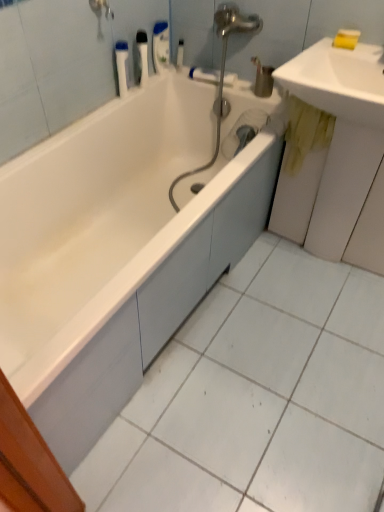
Question: Could you tell me if white plastic bottle at upper center, which is counted as the 3th toiletry, starting from the left, is turned towards yellow stained wood at right?

Choices:
 (A) no
 (B) yes

Answer: (B)

Question: From a real-world perspective, is white plastic bottle at upper center, which is counted as the 3th toiletry, starting from the left, positioned over yellow stained wood at right based on gravity?

Choices:
 (A) no
 (B) yes

Answer: (B)

Question: Does white plastic bottle at upper center, acting as the second toiletry starting from the right, have a greater height compared to yellow stained wood at right?

Choices:
 (A) no
 (B) yes

Answer: (A)

Question: Is white plastic bottle at upper center, which is counted as the 3th toiletry, starting from the left, shorter than yellow stained wood at right?

Choices:
 (A) no
 (B) yes

Answer: (B)

Question: Is white plastic bottle at upper center, which is counted as the 3th toiletry, starting from the left, touching yellow stained wood at right?

Choices:
 (A) no
 (B) yes

Answer: (A)

Question: Does point (226, 110) appear closer or farther from the camera than point (140, 59)?

Choices:
 (A) farther
 (B) closer

Answer: (A)

Question: Do you think matte silver faucet at center is within white plastic bottle at upper center, the 2th toiletry viewed from the left, or outside of it?

Choices:
 (A) inside
 (B) outside

Answer: (B)

Question: Looking at the image, does matte silver faucet at center seem bigger or smaller compared to white plastic bottle at upper center, the 2th toiletry viewed from the left?

Choices:
 (A) small
 (B) big

Answer: (A)

Question: Looking at their shapes, would you say matte silver faucet at center is wider or thinner than white plastic bottle at upper center, the 3th toiletry from the right?

Choices:
 (A) thin
 (B) wide

Answer: (A)

Question: Does point (140, 48) appear closer or farther from the camera than point (61, 200)?

Choices:
 (A) farther
 (B) closer

Answer: (A)

Question: From the image's perspective, relative to white glossy bathtub at center, is white plastic bottle at upper center, the 3th toiletry from the right, above or below?

Choices:
 (A) above
 (B) below

Answer: (A)

Question: Is white plastic bottle at upper center, the 2th toiletry viewed from the left, spatially inside white glossy bathtub at center, or outside of it?

Choices:
 (A) outside
 (B) inside

Answer: (A)

Question: Looking at their shapes, would you say white plastic bottle at upper center, the 3th toiletry from the right, is wider or thinner than white glossy bathtub at center?

Choices:
 (A) thin
 (B) wide

Answer: (A)

Question: From a real-world perspective, is white plastic bottle at upper center, which is counted as the 3th toiletry, starting from the left, physically located above or below yellow stained wood at right?

Choices:
 (A) below
 (B) above

Answer: (B)

Question: Is white plastic bottle at upper center, acting as the second toiletry starting from the right, wider or thinner than yellow stained wood at right?

Choices:
 (A) thin
 (B) wide

Answer: (A)